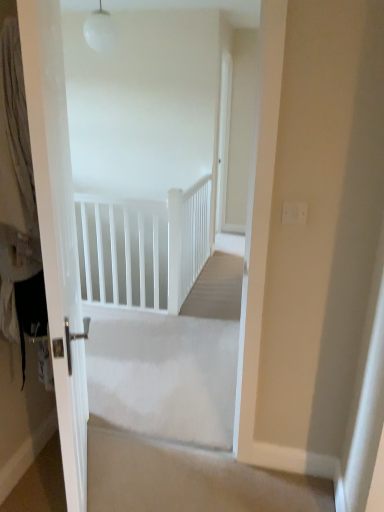
Locate an element on the screen. The width and height of the screenshot is (384, 512). free spot below white glossy door at left (from a real-world perspective) is located at coordinates (94, 462).